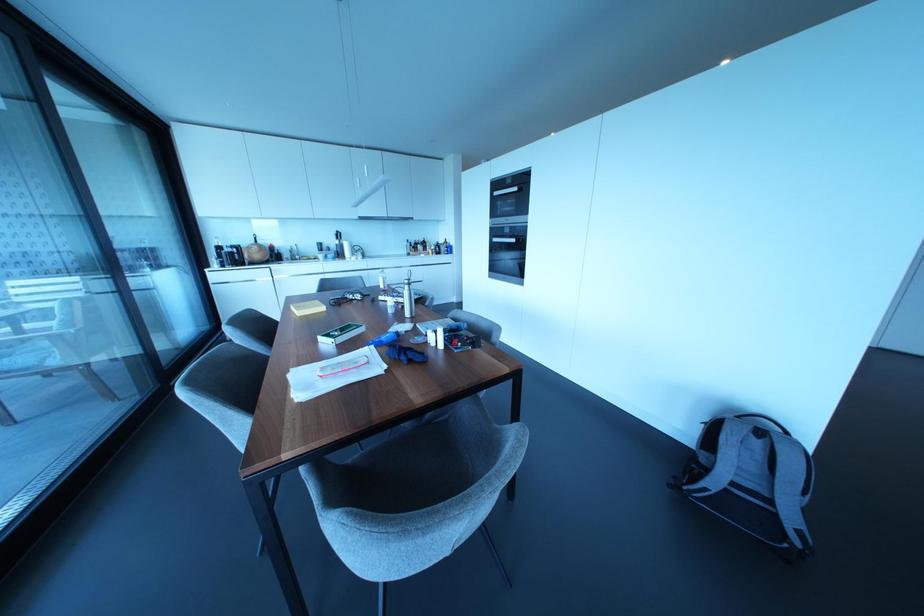
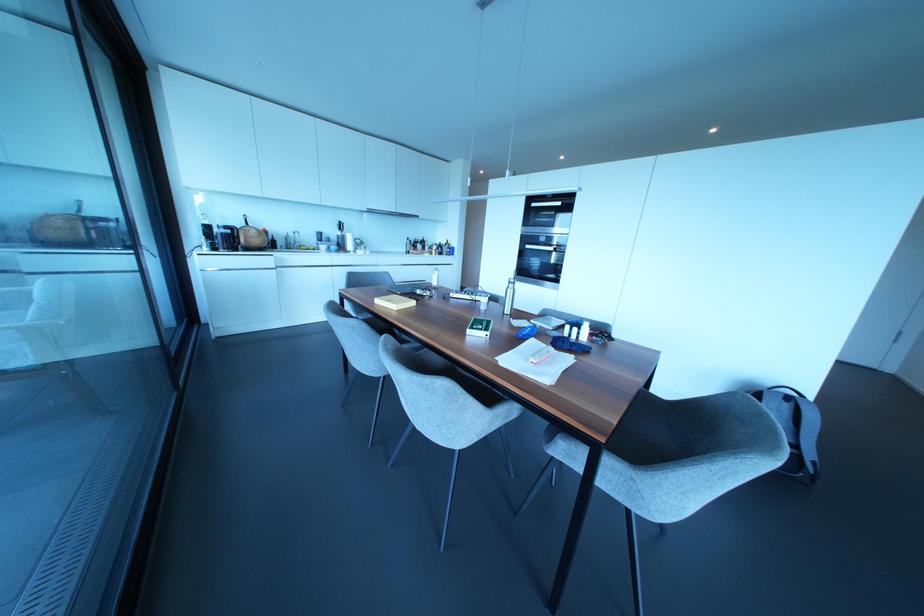
Find the pixel in the second image that matches point (760, 432) in the first image.

(787, 397)